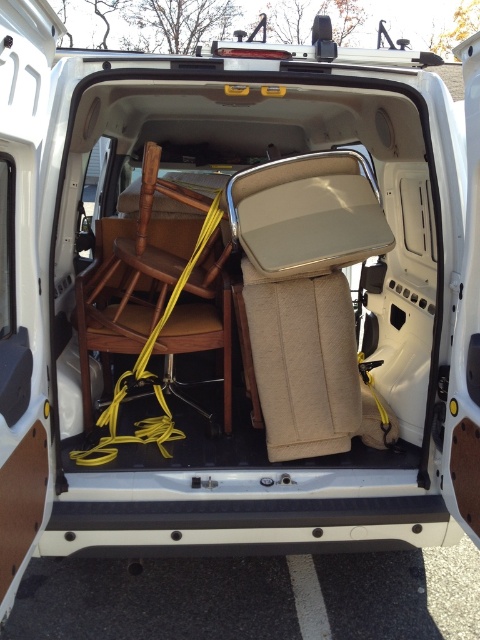
Question: Is beige fabric folding chair at center thinner than wooden chair at center?

Choices:
 (A) no
 (B) yes

Answer: (B)

Question: Is beige fabric folding chair at center further to camera compared to wooden chair at center?

Choices:
 (A) no
 (B) yes

Answer: (A)

Question: Which of the following is the farthest from the observer?

Choices:
 (A) (292, 289)
 (B) (83, 328)

Answer: (B)

Question: Can you confirm if beige fabric folding chair at center is positioned above wooden chair at center?

Choices:
 (A) no
 (B) yes

Answer: (A)

Question: Which point is closer to the camera?

Choices:
 (A) (170, 196)
 (B) (264, 230)

Answer: (B)